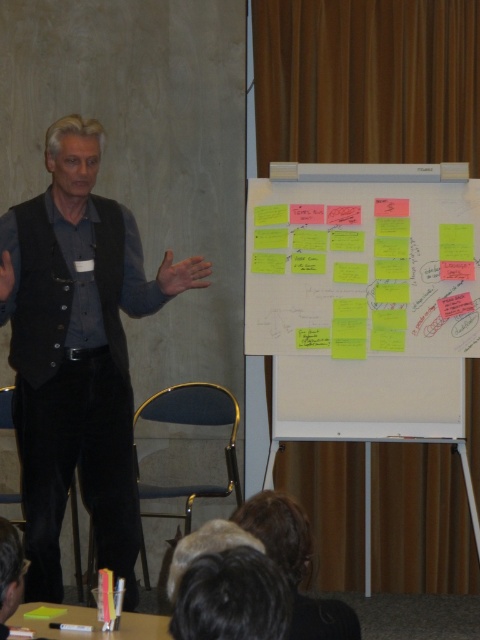
Is yellow sticky notes at center shorter than black matte vest at left?

Correct, yellow sticky notes at center is not as tall as black matte vest at left.

Can you confirm if yellow sticky notes at center is wider than black matte vest at left?

Indeed, yellow sticky notes at center has a greater width compared to black matte vest at left.

Between point (383, 298) and point (61, 451), which one is positioned behind?

The point (383, 298) is more distant.

Identify the location of yellow sticky notes at center. The width and height of the screenshot is (480, 640). (363, 298).